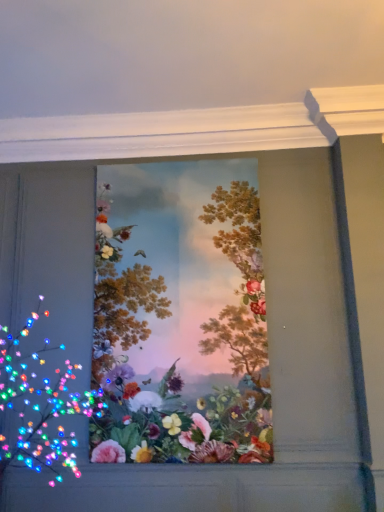
Question: Is matte floral arrangement at left, which is the second flower from back to front, wider or thinner than vibrant floral bouquet at center, positioned as the 1th flower in back-to-front order?

Choices:
 (A) thin
 (B) wide

Answer: (B)

Question: From the image's perspective, relative to vibrant floral bouquet at center, the 2th flower when ordered from front to back, is matte floral arrangement at left, which is counted as the first flower, starting from the front, above or below?

Choices:
 (A) below
 (B) above

Answer: (A)

Question: From a real-world perspective, is matte floral arrangement at left, which is counted as the first flower, starting from the front, above or below vibrant floral bouquet at center, the 2th flower when ordered from front to back?

Choices:
 (A) below
 (B) above

Answer: (A)

Question: Is vibrant floral bouquet at center, positioned as the 1th flower in back-to-front order, spatially inside matte floral arrangement at left, which is the second flower from back to front, or outside of it?

Choices:
 (A) outside
 (B) inside

Answer: (A)

Question: In the image, is vibrant floral bouquet at center, the 2th flower when ordered from front to back, positioned in front of or behind matte floral arrangement at left, which is the second flower from back to front?

Choices:
 (A) front
 (B) behind

Answer: (B)

Question: Would you say vibrant floral bouquet at center, the 2th flower when ordered from front to back, is to the left or to the right of matte floral arrangement at left, which is counted as the first flower, starting from the front, in the picture?

Choices:
 (A) right
 (B) left

Answer: (A)

Question: Looking at their shapes, would you say vibrant floral bouquet at center, the 2th flower when ordered from front to back, is wider or thinner than matte floral arrangement at left, which is counted as the first flower, starting from the front?

Choices:
 (A) thin
 (B) wide

Answer: (A)